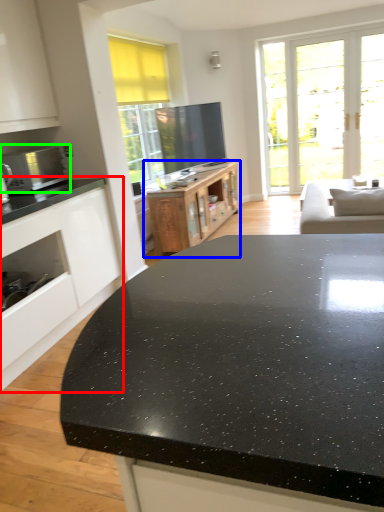
Question: Which object is the farthest from cabinetry (highlighted by a red box)? Choose among these: cabinetry (highlighted by a blue box) or microwave oven (highlighted by a green box).

Choices:
 (A) cabinetry
 (B) microwave oven

Answer: (A)